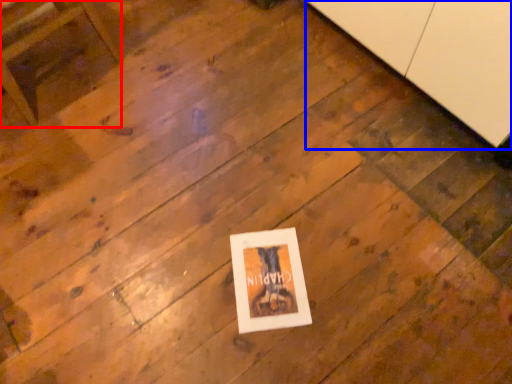
Question: Which object appears farthest to the camera in this image, furniture (highlighted by a red box) or cabinetry (highlighted by a blue box)?

Choices:
 (A) furniture
 (B) cabinetry

Answer: (A)